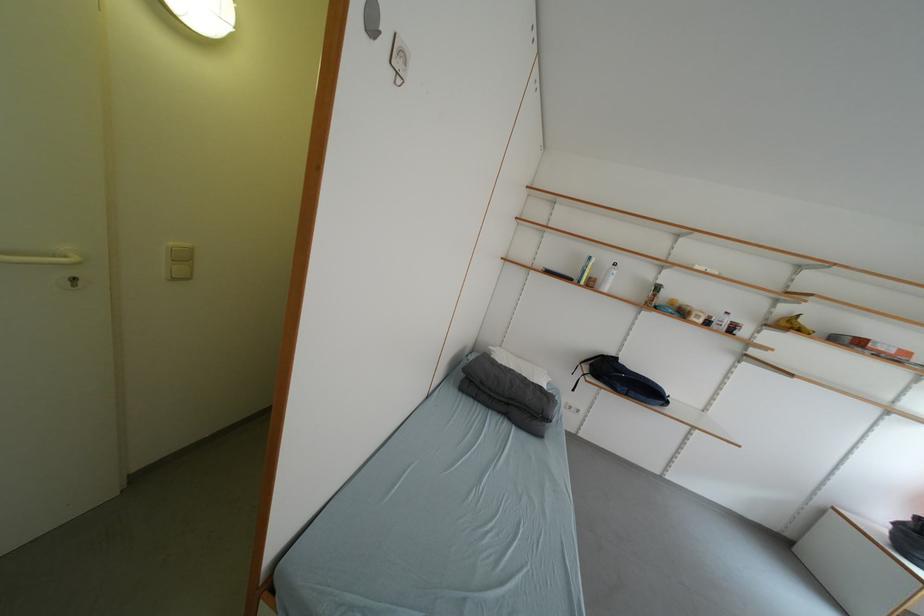
You are a GUI agent. You are given a task and a screenshot of the screen. Output one action in this format:
    pyautogui.click(x=<x>, y=<y>)
    Task: Click on the door keyhole
    The height and width of the screenshot is (616, 924).
    Given the screenshot: What is the action you would take?
    pyautogui.click(x=73, y=281)